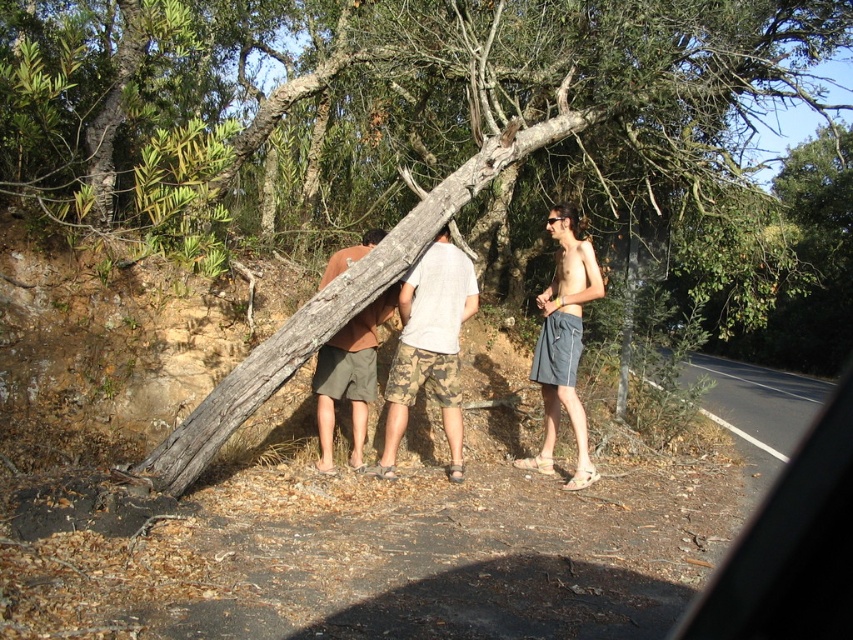
You are a photographer trying to capture both the camo shorts at center and the gray fabric shorts at right in the same frame. Based on their heights, which one will appear larger in the photo?

The gray fabric shorts at right will appear larger in the photo because it is taller than the camo shorts at center.

You are a hiker who notices two pairs of shorts in the scene. The camouflage shorts at center and the gray fabric shorts at right. Which pair is positioned closer to the left side of the image?

The camouflage shorts at center are positioned to the left of the gray fabric shorts at right, so the camouflage shorts at center are closer to the left side of the image.

You are a hiker trying to decide which pair of shorts to wear for a hike. You notice two options in the image, camouflage shorts at center and brown cotton shorts at center. Based on their appearance, which pair might be more suitable for rough terrain?

The camouflage shorts at center has a greater height compared to brown cotton shorts at center, so they might provide better coverage and protection for rough terrain.